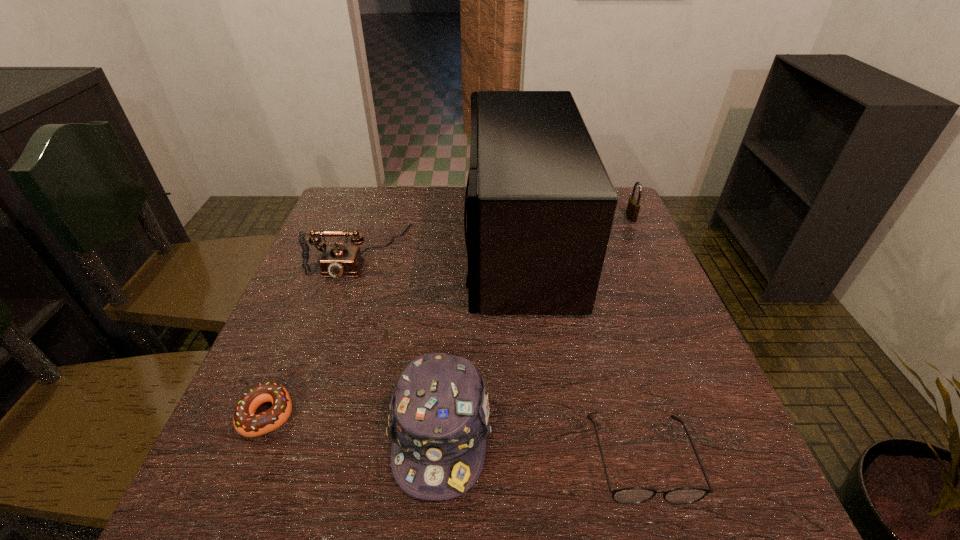
At what (x,y) coordinates should I click in order to perform the action: click on free spot located 0.120m on the front of the padlock. Please return your answer as a coordinate pair (x, y). This screenshot has width=960, height=540. Looking at the image, I should click on (645, 248).

Where is `free space located on the front of the shortest object`? Image resolution: width=960 pixels, height=540 pixels. free space located on the front of the shortest object is located at coordinates (238, 489).

Locate an element on the screen. The image size is (960, 540). microwave_oven present at the far edge is located at coordinates (540, 208).

Locate an element on the screen. telephone located in the far edge section of the desktop is located at coordinates (336, 261).

Identify the location of padlock present at the far edge. The image size is (960, 540). click(x=633, y=206).

You are a GUI agent. You are given a task and a screenshot of the screen. Output one action in this format:
    pyautogui.click(x=<x>, y=<y>)
    Task: Click on the headwear located in the near edge section of the desktop
    The height and width of the screenshot is (540, 960).
    Given the screenshot: What is the action you would take?
    pyautogui.click(x=438, y=422)

You are a GUI agent. You are given a task and a screenshot of the screen. Output one action in this format:
    pyautogui.click(x=<x>, y=<y>)
    Task: Click on the spectacles that is at the near edge
    This screenshot has height=540, width=960.
    Given the screenshot: What is the action you would take?
    pyautogui.click(x=633, y=495)

I want to click on telephone present at the left edge, so click(336, 261).

Locate an element on the screen. doughnut that is at the left edge is located at coordinates (247, 423).

You are a GUI agent. You are given a task and a screenshot of the screen. Output one action in this format:
    pyautogui.click(x=<x>, y=<y>)
    Task: Click on the padlock at the right edge
    This screenshot has height=540, width=960.
    Given the screenshot: What is the action you would take?
    pyautogui.click(x=633, y=206)